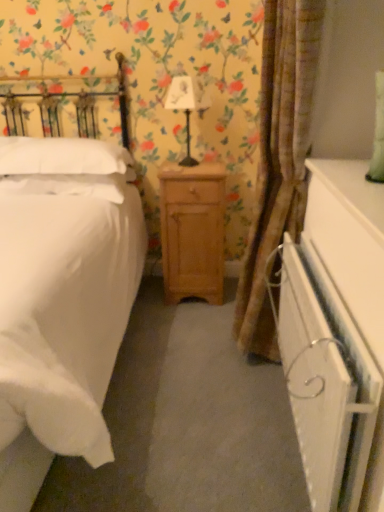
Locate an element on the screen. vacant space situated on the left part of brown textured curtain at center is located at coordinates pyautogui.click(x=173, y=376).